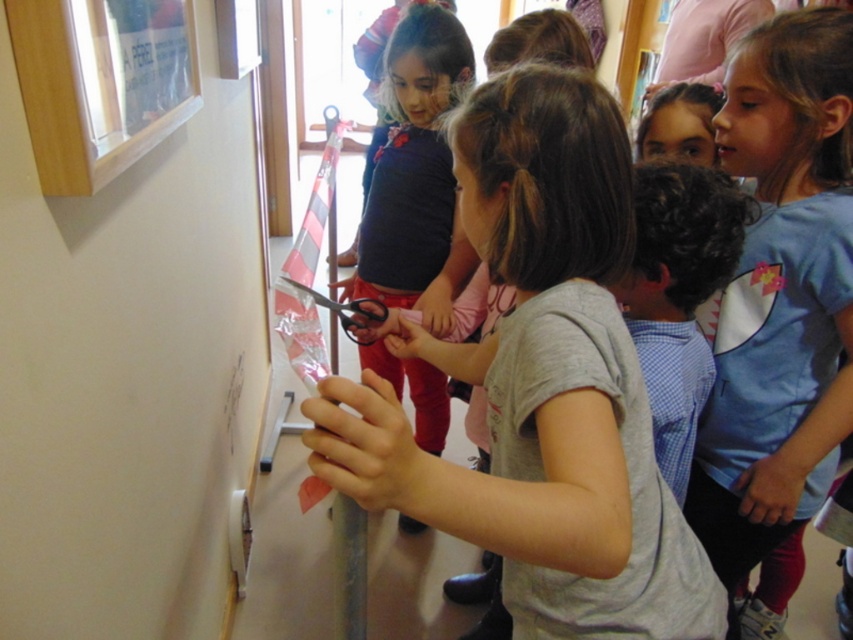
Which is in front, point (741, 328) or point (27, 6)?

Point (27, 6) is in front.

Does blue cotton shirt at center have a greater width compared to wooden frame at upper left?

Correct, the width of blue cotton shirt at center exceeds that of wooden frame at upper left.

Does point (770, 284) come farther from viewer compared to point (67, 122)?

Yes, it is.

Identify the location of blue cotton shirt at center. The height and width of the screenshot is (640, 853). (779, 296).

In the scene shown: Does matte black shirt at center come in front of wooden frame at upper left?

No, it is not.

Is matte black shirt at center thinner than wooden frame at upper left?

Incorrect, matte black shirt at center's width is not less than wooden frame at upper left's.

Between point (403, 248) and point (144, 125), which one is positioned in front?

Point (144, 125) is in front.

Locate an element on the screen. matte black shirt at center is located at coordinates (416, 176).

Who is lower down, blue cotton shirt at center or matte black shirt at center?

blue cotton shirt at center is lower down.

Between blue cotton shirt at center and matte black shirt at center, which one has more height?

With more height is matte black shirt at center.

Between point (785, 22) and point (364, 268), which one is positioned in front?

Positioned in front is point (785, 22).

Where is `blue cotton shirt at center`? Image resolution: width=853 pixels, height=640 pixels. blue cotton shirt at center is located at coordinates (779, 296).